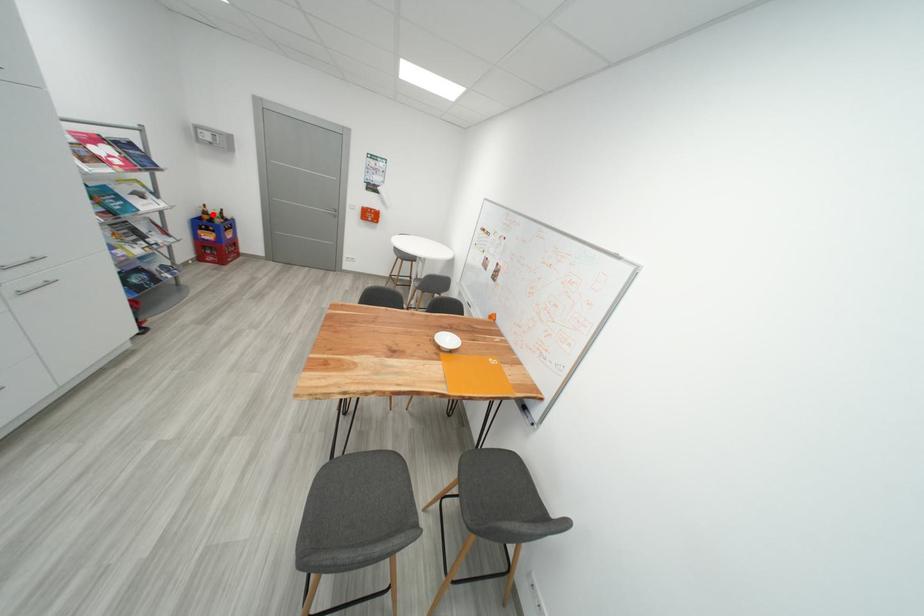
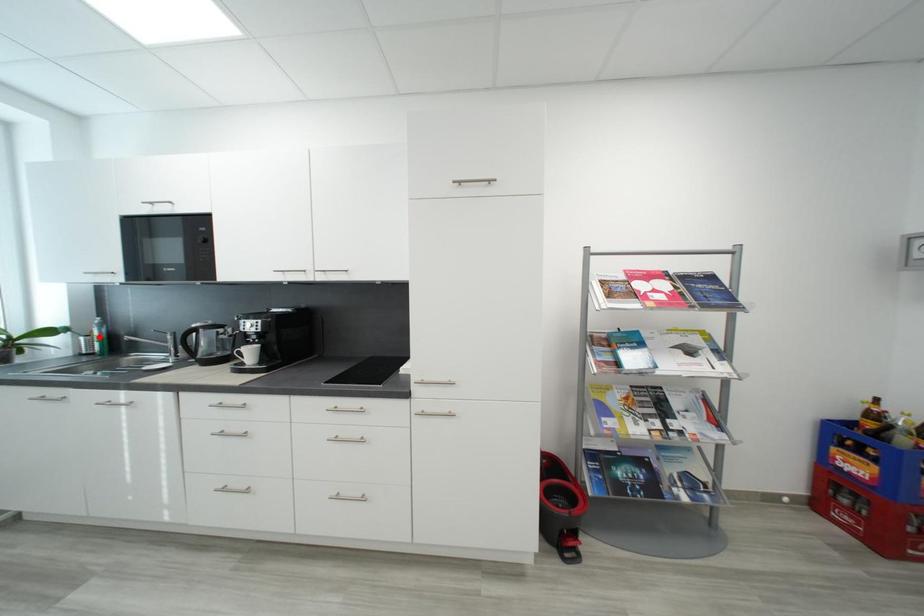
I am providing you with two images of the same scene from different viewpoints. A red point is marked on the first image and another point is marked on the second image. Are the points marked in image1 and image2 representing the same 3D position?

No